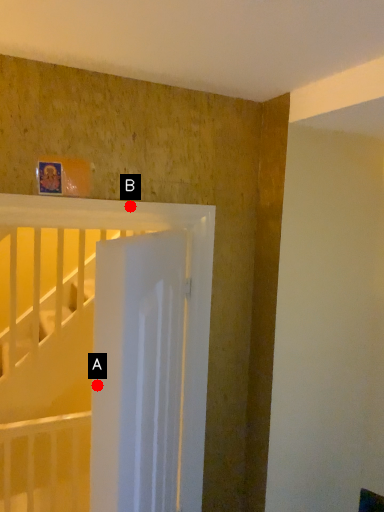
Question: Two points are circled on the image, labeled by A and B beside each circle. Which point is closer to the camera?

Choices:
 (A) A is closer
 (B) B is closer

Answer: (A)